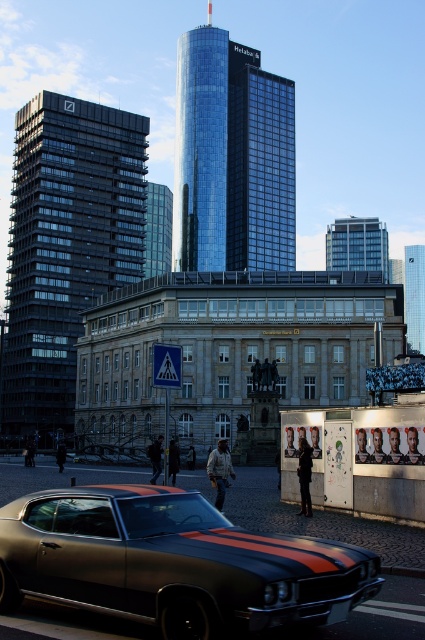
This screenshot has height=640, width=425. What do you see at coordinates (232, 157) in the screenshot?
I see `glassy metallic skyscraper at center` at bounding box center [232, 157].

Can you confirm if glassy metallic skyscraper at center is thinner than silver glass skyscraper at center?

Yes.

You are a GUI agent. You are given a task and a screenshot of the screen. Output one action in this format:
    pyautogui.click(x=<x>, y=<y>)
    Task: Click on the glassy metallic skyscraper at center
    Image resolution: width=425 pixels, height=640 pixels.
    Given the screenshot: What is the action you would take?
    pyautogui.click(x=232, y=157)

You are a GUI agent. You are given a task and a screenshot of the screen. Output one action in this format:
    pyautogui.click(x=<x>, y=<y>)
    Task: Click on the glassy metallic skyscraper at center
    This screenshot has width=425, height=640.
    Given the screenshot: What is the action you would take?
    pyautogui.click(x=232, y=157)

Can you confirm if shiny black car at center is positioned above silver glass skyscraper at center?

Actually, shiny black car at center is below silver glass skyscraper at center.

You are a GUI agent. You are given a task and a screenshot of the screen. Output one action in this format:
    pyautogui.click(x=<x>, y=<y>)
    Task: Click on the shiny black car at center
    Image resolution: width=425 pixels, height=640 pixels.
    Given the screenshot: What is the action you would take?
    pyautogui.click(x=172, y=563)

The image size is (425, 640). Identify the location of shiny black car at center. (172, 563).

Who is more forward, (37, 140) or (178, 205)?

Point (37, 140) is more forward.

Who is more forward, (116, 176) or (175, 173)?

Positioned in front is point (116, 176).

You are a GUI agent. You are given a task and a screenshot of the screen. Output one action in this format:
    pyautogui.click(x=<x>, y=<y>)
    Task: Click on the dark glass skyscraper at left
    
    Given the screenshot: What is the action you would take?
    pyautogui.click(x=65, y=246)